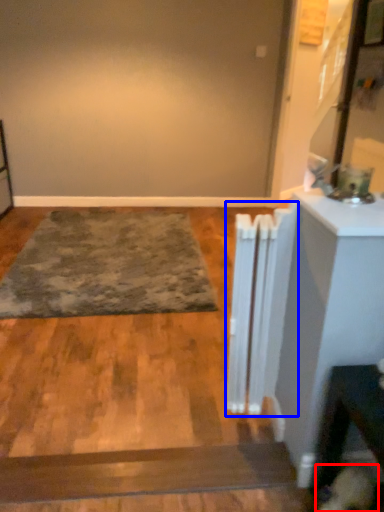
Question: Which point is further to the camera, dog (highlighted by a red box) or radiator (highlighted by a blue box)?

Choices:
 (A) dog
 (B) radiator

Answer: (B)